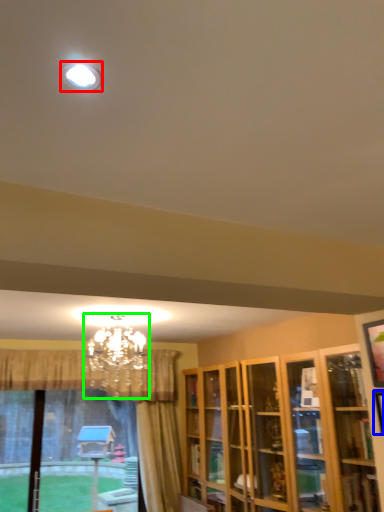
Question: Considering the real-world distances, which object is farthest from lighting (highlighted by a red box)? picture frame (highlighted by a blue box) or lamp (highlighted by a green box)?

Choices:
 (A) picture frame
 (B) lamp

Answer: (B)